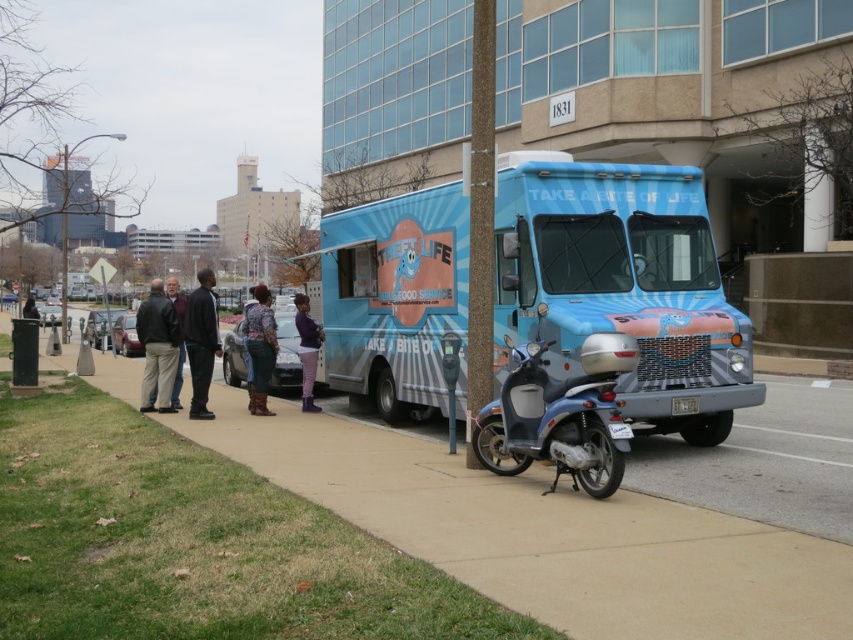
Question: Which point appears closest to the camera in this image?

Choices:
 (A) (529, 385)
 (B) (155, 356)

Answer: (A)

Question: Does smooth concrete sidewalk at center appear under metallic blue scooter at center?

Choices:
 (A) yes
 (B) no

Answer: (A)

Question: Considering the real-world distances, which object is farthest from the dark brown leather jacket at center?

Choices:
 (A) black leather jacket at center
 (B) blue glossy food truck at center

Answer: (B)

Question: Is metallic blue scooter at center to the left of black leather jacket at center from the viewer's perspective?

Choices:
 (A) no
 (B) yes

Answer: (A)

Question: Which of the following is the farthest from the observer?

Choices:
 (A) pyautogui.click(x=508, y=218)
 (B) pyautogui.click(x=612, y=401)

Answer: (A)

Question: Can you confirm if metallic blue scooter at center is wider than black leather jacket at center?

Choices:
 (A) yes
 (B) no

Answer: (B)